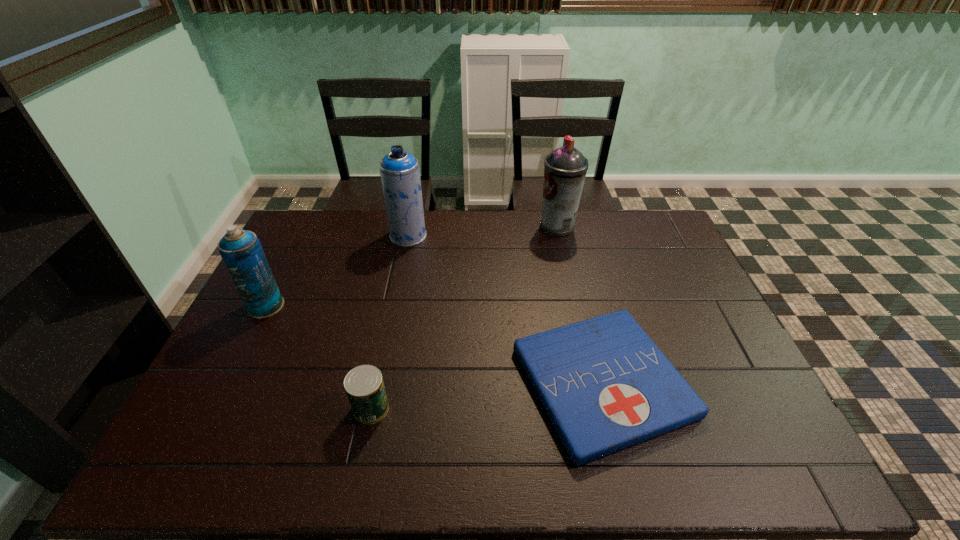
At what (x,y) coordinates should I click in order to perform the action: click on free spot at the near right corner of the desktop. Please return your answer as a coordinate pair (x, y). This screenshot has width=960, height=540. Looking at the image, I should click on (746, 462).

Locate an element on the screen. The image size is (960, 540). vacant area that lies between the rightmost aerosol can and the can is located at coordinates (465, 318).

At what (x,y) coordinates should I click in order to perform the action: click on vacant region between the second aerosol can from right to left and the shortest object. Please return your answer as a coordinate pair (x, y). Looking at the image, I should click on (505, 309).

Identify the location of vacant space that's between the can and the second aerosol can from right to left. pyautogui.click(x=390, y=322).

Locate an element on the screen. The width and height of the screenshot is (960, 540). free area in between the rightmost aerosol can and the first-aid kit is located at coordinates (580, 304).

Identify the location of vacant point located between the shortest object and the third tallest object. 434,344.

Locate an element on the screen. The image size is (960, 540). free space between the shortest object and the second aerosol can from left to right is located at coordinates (505, 309).

The height and width of the screenshot is (540, 960). What are the coordinates of `empty space between the second shortest object and the shortest object` in the screenshot? It's located at [487, 395].

Locate an element on the screen. The width and height of the screenshot is (960, 540). free spot between the first-aid kit and the second aerosol can from right to left is located at coordinates (505, 309).

This screenshot has height=540, width=960. I want to click on unoccupied area between the shortest object and the second aerosol can from right to left, so click(505, 309).